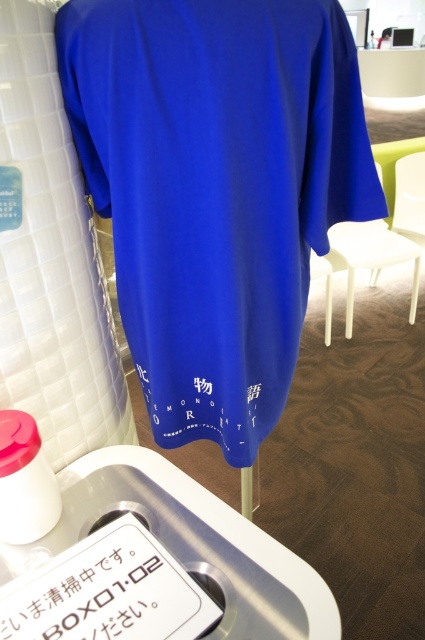
You are standing in a store and see the white paper at lower center. If you want to pick it up, will you need to move closer than 28 inches to reach it?

The white paper at lower center is 28.02 inches away from the viewer, so you will need to move closer than 28 inches to reach it.

You are a customer in a store and see the white paper at lower center. Where would you look to find it in relation to the royal blue T shirt?

The white paper at lower center is located at the point with coordinates 0.930 on the x axis and 0.214 on the y axis, so it is positioned to the right and slightly below the royal blue T shirt.